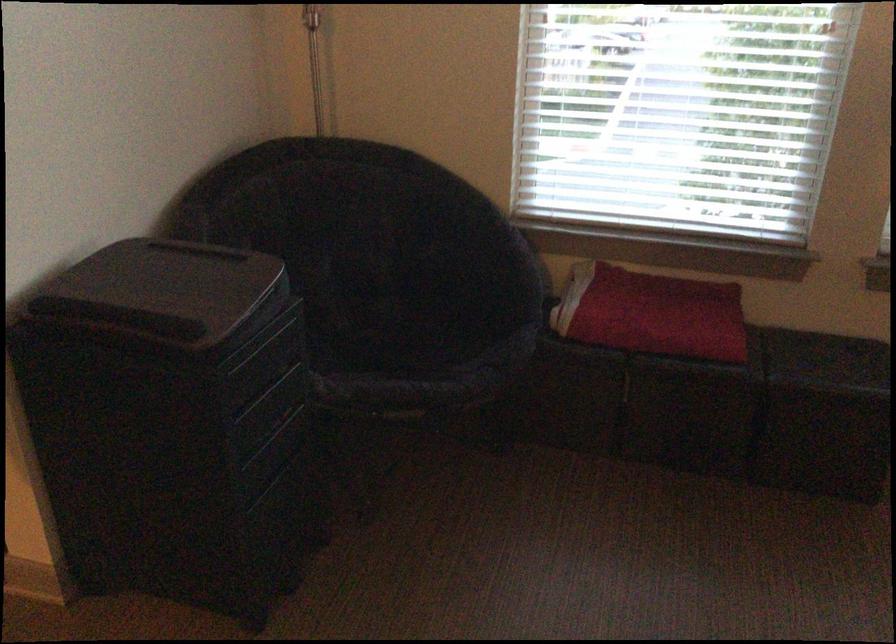
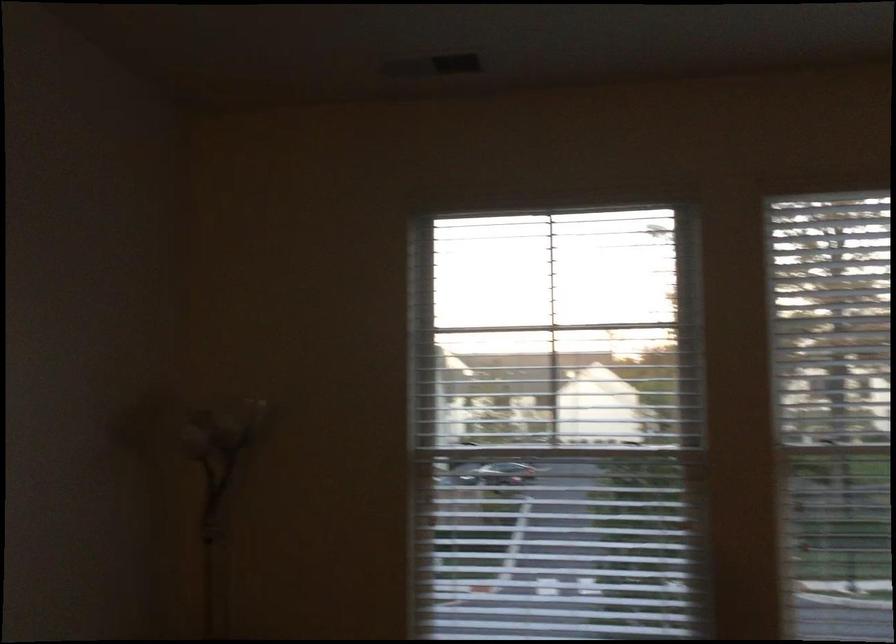
Question: In a continuous first-person perspective shot, in which direction is the camera moving?

Choices:
 (A) Left
 (B) Right
 (C) Forward
 (D) Backward

Answer: (D)